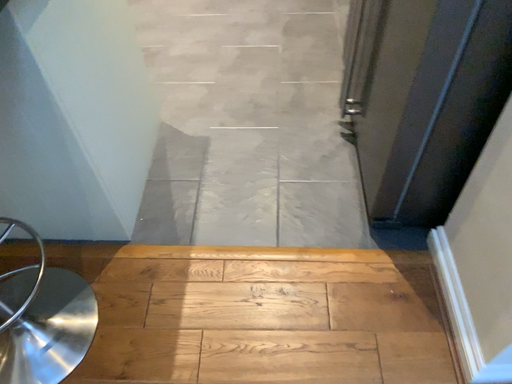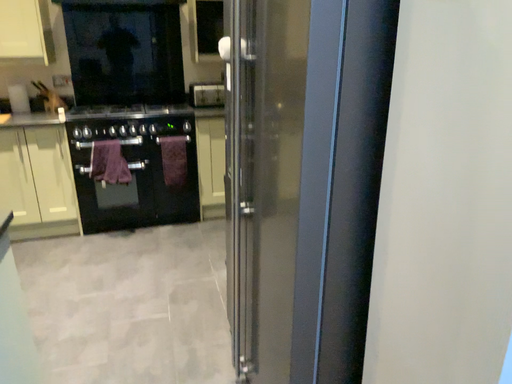
Question: How did the camera likely rotate when shooting the video?

Choices:
 (A) rotated downward
 (B) rotated upward

Answer: (B)